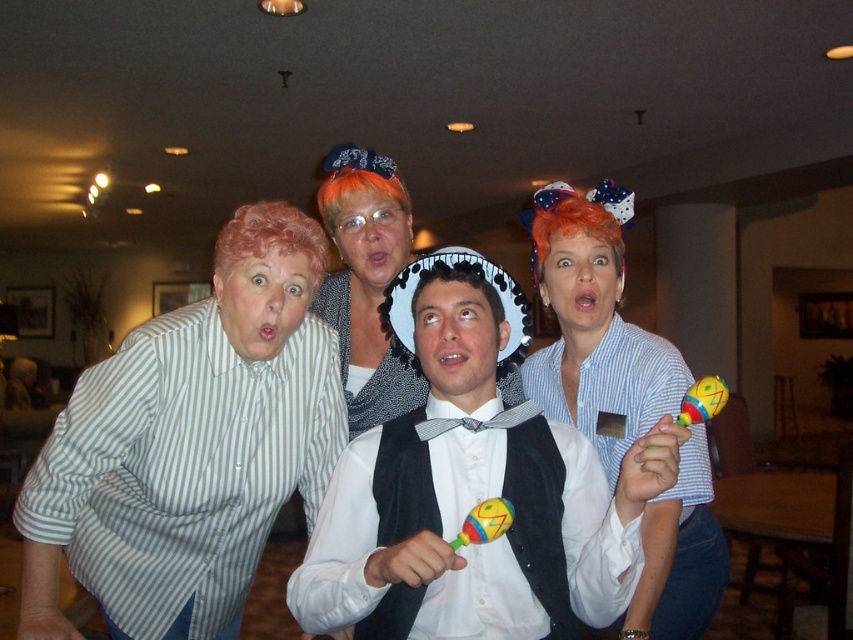
Does orange synthetic wig at upper right appear under orange synthetic wig at center?

Yes.

Can you confirm if orange synthetic wig at upper right is positioned above orange synthetic wig at center?

Incorrect, orange synthetic wig at upper right is not positioned above orange synthetic wig at center.

Describe the element at coordinates (575, 216) in the screenshot. I see `orange synthetic wig at upper right` at that location.

This screenshot has width=853, height=640. What are the coordinates of `orange synthetic wig at upper right` in the screenshot? It's located at (575, 216).

The image size is (853, 640). What do you see at coordinates (270, 237) in the screenshot?
I see `curly blonde wig at left` at bounding box center [270, 237].

Which is in front, point (302, 240) or point (492, 307)?

Point (492, 307) is more forward.

Locate an element on the screen. This screenshot has width=853, height=640. curly blonde wig at left is located at coordinates (270, 237).

What are the coordinates of `curly blonde wig at left` in the screenshot? It's located at (270, 237).

Looking at this image, is the position of gray scarf at center more distant than that of orange synthetic wig at center?

No, it is not.

Can you confirm if gray scarf at center is positioned to the right of orange synthetic wig at center?

Yes, gray scarf at center is to the right of orange synthetic wig at center.

Between point (393, 177) and point (389, 170), which one is positioned behind?

The point (393, 177) is behind.

In order to click on gray scarf at center in this screenshot , I will do `click(364, 280)`.